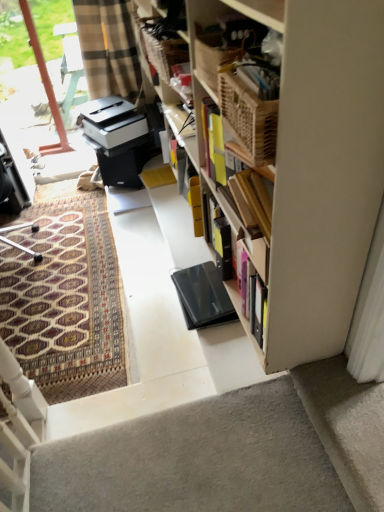
Question: Is wooden picnic basket at upper center looking in the opposite direction of gray carpet at bottom right?

Choices:
 (A) no
 (B) yes

Answer: (A)

Question: Is wooden picnic basket at upper center outside gray carpet at bottom right?

Choices:
 (A) no
 (B) yes

Answer: (B)

Question: Does wooden picnic basket at upper center have a greater width compared to gray carpet at bottom right?

Choices:
 (A) yes
 (B) no

Answer: (B)

Question: Is wooden picnic basket at upper center further to the viewer compared to gray carpet at bottom right?

Choices:
 (A) no
 (B) yes

Answer: (B)

Question: Does wooden picnic basket at upper center appear on the right side of gray carpet at bottom right?

Choices:
 (A) no
 (B) yes

Answer: (A)

Question: Can you confirm if wooden picnic basket at upper center is taller than gray carpet at bottom right?

Choices:
 (A) yes
 (B) no

Answer: (A)

Question: Can you confirm if gray carpet at bottom right is shorter than transparent glass door at upper left?

Choices:
 (A) yes
 (B) no

Answer: (A)

Question: Is gray carpet at bottom right not near transparent glass door at upper left?

Choices:
 (A) no
 (B) yes

Answer: (B)

Question: Is gray carpet at bottom right facing away from transparent glass door at upper left?

Choices:
 (A) yes
 (B) no

Answer: (B)

Question: From a real-world perspective, is gray carpet at bottom right over transparent glass door at upper left?

Choices:
 (A) yes
 (B) no

Answer: (B)

Question: From the image's perspective, is gray carpet at bottom right on transparent glass door at upper left?

Choices:
 (A) no
 (B) yes

Answer: (A)

Question: Is gray carpet at bottom right next to transparent glass door at upper left and touching it?

Choices:
 (A) no
 (B) yes

Answer: (A)

Question: Is gray carpet at bottom right bigger than black matte laptop at center?

Choices:
 (A) yes
 (B) no

Answer: (B)